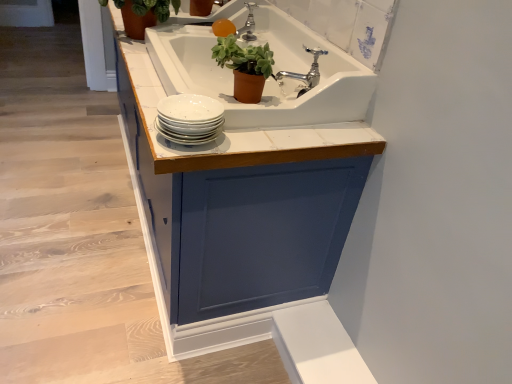
Identify the location of free location in front of chrome metallic faucet at upper center, positioned as the first tap in front-to-back order. The height and width of the screenshot is (384, 512). (294, 130).